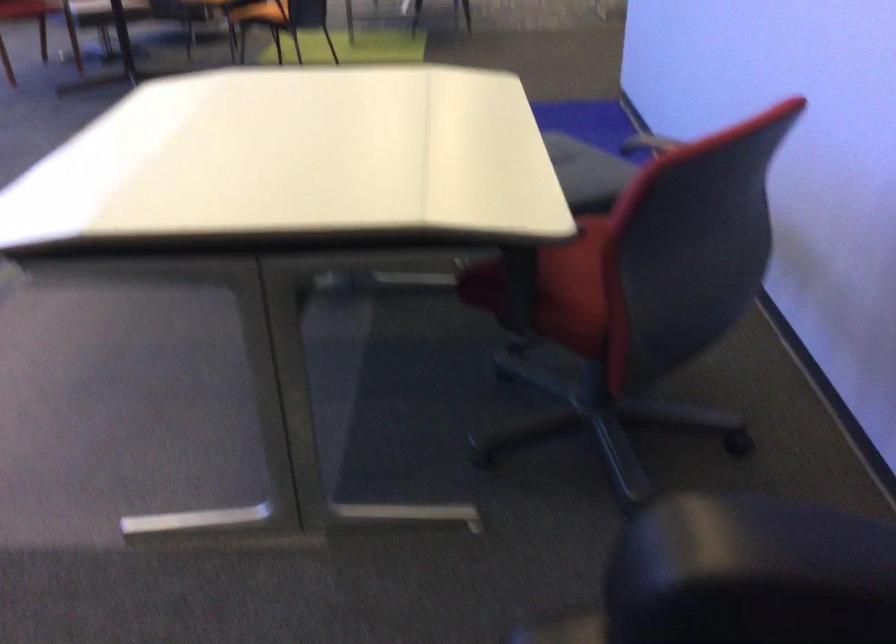
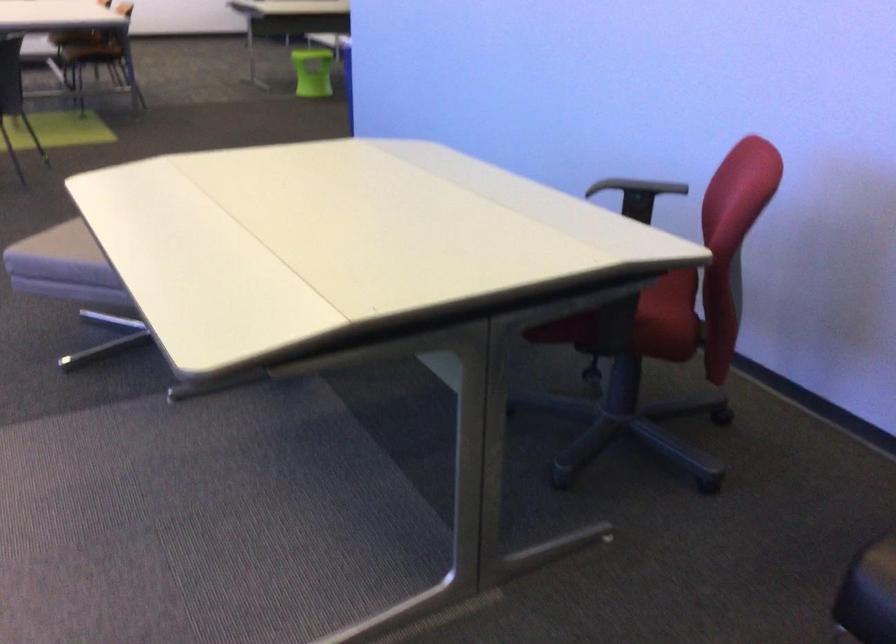
In the second image, find the point that corresponds to (x=633, y=289) in the first image.

(669, 299)